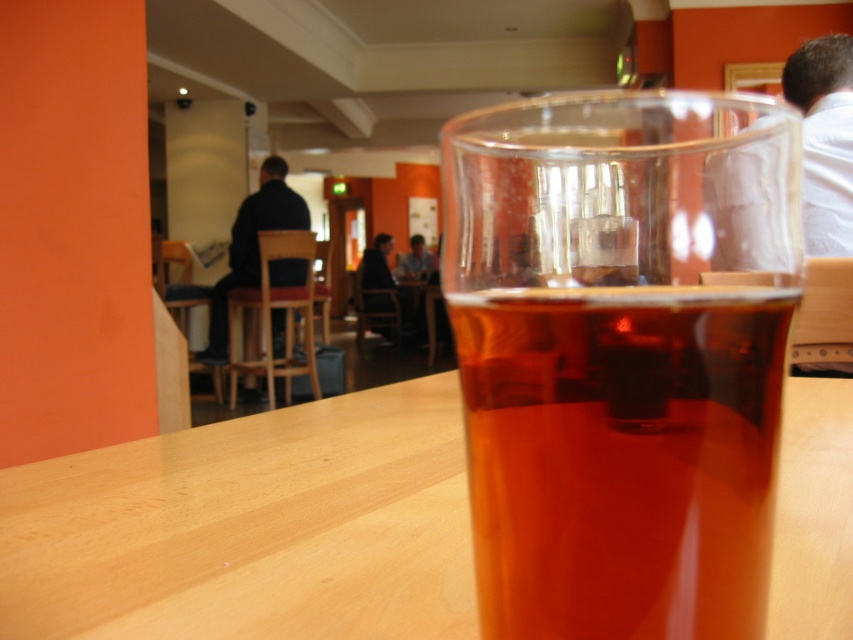
Question: Among these points, which one is nearest to the camera?

Choices:
 (A) (624, 316)
 (B) (434, 614)

Answer: (A)

Question: Is translucent glass at center to the left of light wood table at center from the viewer's perspective?

Choices:
 (A) yes
 (B) no

Answer: (A)

Question: Which of the following is the closest to the observer?

Choices:
 (A) (782, 131)
 (B) (825, 416)

Answer: (A)

Question: Is translucent glass at center positioned before light wood table at center?

Choices:
 (A) yes
 (B) no

Answer: (A)

Question: Is translucent glass at center further to the viewer compared to light wood table at center?

Choices:
 (A) no
 (B) yes

Answer: (A)